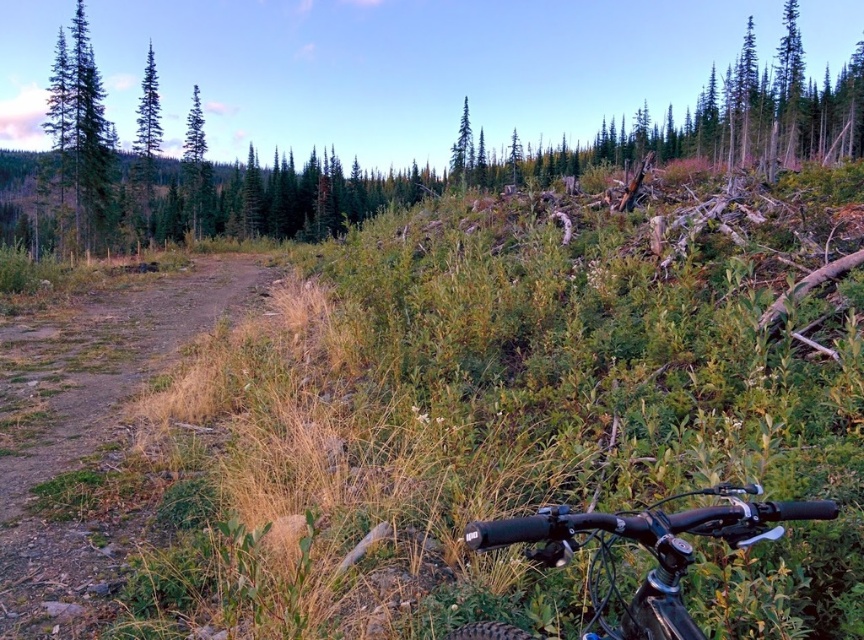
Question: Can you confirm if dirt/gravel path at left is positioned to the left of green matte tree at upper left?

Choices:
 (A) yes
 (B) no

Answer: (B)

Question: Estimate the real-world distances between objects in this image. Which object is closer to the green textured tree at upper left?

Choices:
 (A) green matte tree at upper left
 (B) black matte bicycle handlebars at lower right

Answer: (A)

Question: Can you confirm if dirt/gravel path at left is bigger than black matte bicycle handlebars at lower right?

Choices:
 (A) no
 (B) yes

Answer: (B)

Question: Which point is closer to the camera taking this photo?

Choices:
 (A) (93, 122)
 (B) (532, 538)

Answer: (B)

Question: Can you confirm if dirt/gravel path at left is wider than green textured tree at upper left?

Choices:
 (A) no
 (B) yes

Answer: (A)

Question: Which is nearer to the green textured tree at upper left?

Choices:
 (A) dirt/gravel path at left
 (B) green matte tree at upper center
 (C) black matte bicycle handlebars at lower right
 (D) green matte tree at upper left

Answer: (D)